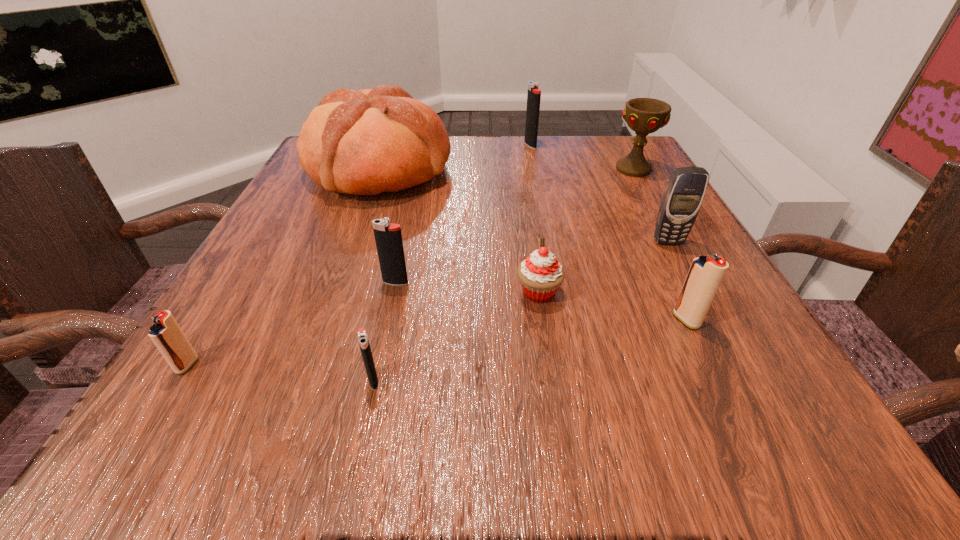
At what (x,y) coordinates should I click in order to perform the action: click on free space located 0.100m on the back of the smaller red igniter. Please return your answer as a coordinate pair (x, y). The width and height of the screenshot is (960, 540). Looking at the image, I should click on (226, 303).

You are a GUI agent. You are given a task and a screenshot of the screen. Output one action in this format:
    pyautogui.click(x=<x>, y=<y>)
    Task: Click on the free space located 0.240m on the back of the smallest black igniter
    Image resolution: width=960 pixels, height=540 pixels.
    Given the screenshot: What is the action you would take?
    pyautogui.click(x=400, y=256)

This screenshot has height=540, width=960. Find the location of `bread located in the far edge section of the desktop`. bread located in the far edge section of the desktop is located at coordinates (366, 142).

Where is `igniter located in the far edge section of the desktop`? The width and height of the screenshot is (960, 540). igniter located in the far edge section of the desktop is located at coordinates (534, 93).

Image resolution: width=960 pixels, height=540 pixels. Identify the location of chalice that is at the far edge. (644, 116).

Find the location of `object located at the near edge`. object located at the near edge is located at coordinates (362, 337).

I want to click on bread situated at the left edge, so click(366, 142).

Find the location of `igniter located at the left edge`. igniter located at the left edge is located at coordinates (166, 334).

Where is `chalice positioned at the right edge`? The image size is (960, 540). chalice positioned at the right edge is located at coordinates (644, 116).

Find the location of a particular element. This screenshot has height=540, width=960. cellular telephone that is at the right edge is located at coordinates (684, 193).